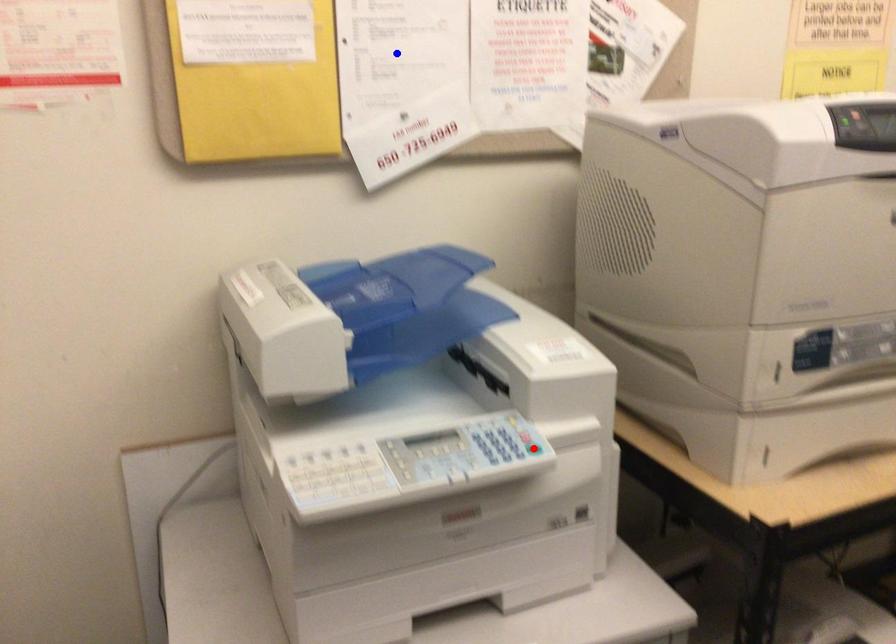
Question: Two points are marked on the image. Which point is closer to the camera?

Choices:
 (A) Blue point is closer.
 (B) Red point is closer.

Answer: (B)